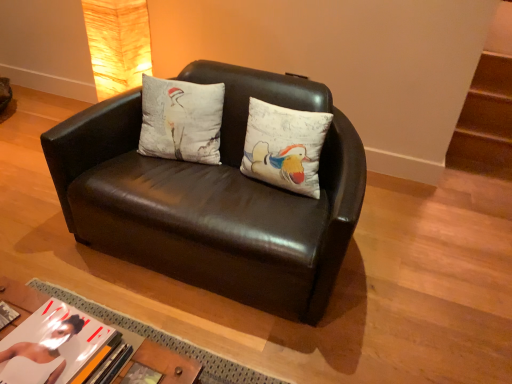
Question: Is hardcover book at lower center, placed as the second book when sorted from left to right, closer to camera compared to matte black couch at center?

Choices:
 (A) no
 (B) yes

Answer: (B)

Question: Does hardcover book at lower center, placed as the 1th book when sorted from right to left, have a greater width compared to matte black couch at center?

Choices:
 (A) no
 (B) yes

Answer: (A)

Question: Is hardcover book at lower center, placed as the second book when sorted from left to right, aimed at matte black couch at center?

Choices:
 (A) yes
 (B) no

Answer: (B)

Question: Is hardcover book at lower center, placed as the second book when sorted from left to right, positioned far away from matte black couch at center?

Choices:
 (A) yes
 (B) no

Answer: (B)

Question: Does hardcover book at lower center, placed as the second book when sorted from left to right, have a greater height compared to matte black couch at center?

Choices:
 (A) no
 (B) yes

Answer: (A)

Question: From the image's perspective, is hardcover book at lower center, placed as the 1th book when sorted from right to left, above matte black couch at center?

Choices:
 (A) yes
 (B) no

Answer: (B)

Question: Does white cotton cushion at center turn towards matte black couch at center?

Choices:
 (A) no
 (B) yes

Answer: (B)

Question: Is white cotton cushion at center not inside matte black couch at center?

Choices:
 (A) yes
 (B) no

Answer: (B)

Question: Is white cotton cushion at center bigger than matte black couch at center?

Choices:
 (A) no
 (B) yes

Answer: (A)

Question: Is white cotton cushion at center taller than matte black couch at center?

Choices:
 (A) no
 (B) yes

Answer: (A)

Question: Considering the relative positions of white cotton cushion at center and matte black couch at center in the image provided, is white cotton cushion at center to the left of matte black couch at center from the viewer's perspective?

Choices:
 (A) yes
 (B) no

Answer: (A)

Question: Does white cotton cushion at center have a lesser width compared to matte black couch at center?

Choices:
 (A) yes
 (B) no

Answer: (A)

Question: Is matte beige lampshade at upper left positioned beyond the bounds of matte paper book at lower left, arranged as the first book when viewed from the left?

Choices:
 (A) yes
 (B) no

Answer: (A)